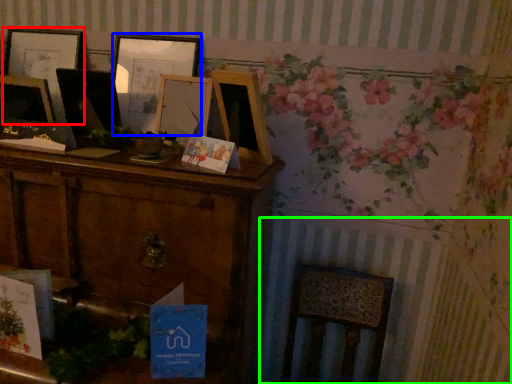
Question: Considering the real-world distances, which object is closest to picture frame (highlighted by a red box)? picture frame (highlighted by a blue box) or radiator (highlighted by a green box).

Choices:
 (A) picture frame
 (B) radiator

Answer: (A)